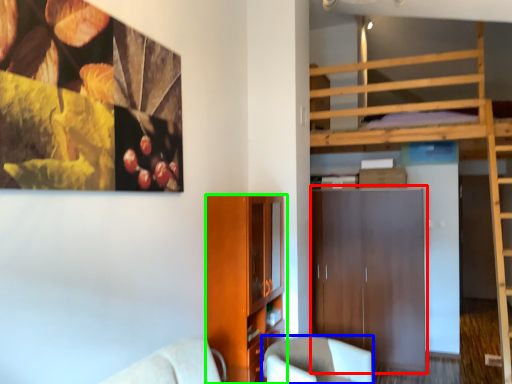
Question: Based on their relative distances, which object is farther from dresser (highlighted by a red box)? Choose from chair (highlighted by a blue box) and cabinetry (highlighted by a green box).

Choices:
 (A) chair
 (B) cabinetry

Answer: (B)